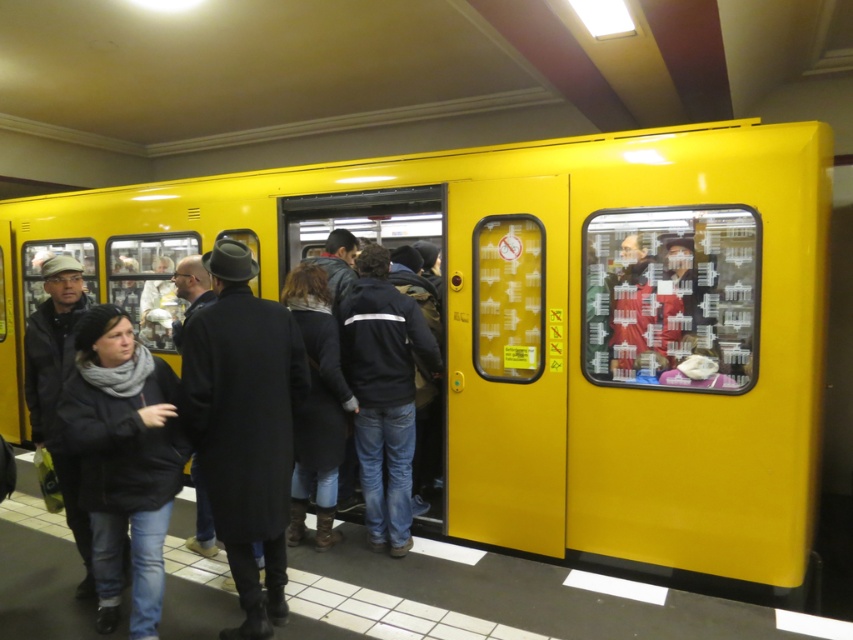
Question: Does metallic yellow train at center have a greater width compared to dark gray fabric coat at left?

Choices:
 (A) no
 (B) yes

Answer: (B)

Question: Which of the following is the farthest from the observer?

Choices:
 (A) (83, 461)
 (B) (241, 298)
 (C) (345, 371)
 (D) (56, 253)

Answer: (D)

Question: Which of the following is the farthest from the observer?

Choices:
 (A) black matte jacket at center
 (B) metallic yellow train at center
 (C) dark gray fabric coat at left

Answer: (A)

Question: Does black matte coat at lower left lie behind black matte jacket at center?

Choices:
 (A) no
 (B) yes

Answer: (A)

Question: Which point is farther from the camera taking this photo?

Choices:
 (A) (782, 125)
 (B) (393, 532)
 (C) (151, 540)

Answer: (B)

Question: Observing the image, what is the correct spatial positioning of metallic yellow train at center in reference to black matte coat at lower left?

Choices:
 (A) below
 (B) above

Answer: (B)